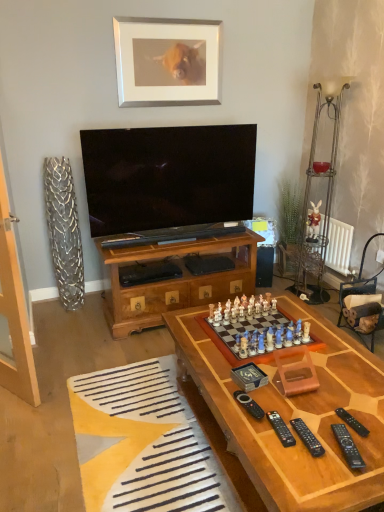
Question: Considering the relative sizes of black plastic remote at lower right, the third remote in the left-to-right sequence, and yellow fabric rug at lower left in the image provided, is black plastic remote at lower right, the third remote in the left-to-right sequence, bigger than yellow fabric rug at lower left?

Choices:
 (A) yes
 (B) no

Answer: (B)

Question: Can we say black plastic remote at lower right, which ranks as the 3th remote in right-to-left order, lies outside yellow fabric rug at lower left?

Choices:
 (A) yes
 (B) no

Answer: (A)

Question: Is black plastic remote at lower right, which ranks as the 3th remote in right-to-left order, oriented towards yellow fabric rug at lower left?

Choices:
 (A) yes
 (B) no

Answer: (B)

Question: Is black plastic remote at lower right, the third remote in the left-to-right sequence, closer to the viewer compared to yellow fabric rug at lower left?

Choices:
 (A) no
 (B) yes

Answer: (B)

Question: Is there a large distance between black plastic remote at lower right, the third remote in the left-to-right sequence, and yellow fabric rug at lower left?

Choices:
 (A) yes
 (B) no

Answer: (B)

Question: Do you think black plastic remote at lower right, the 4th remote in the right-to-left sequence, is within black plastic remote at center, which appears as the first remote when viewed from the left, or outside of it?

Choices:
 (A) inside
 (B) outside

Answer: (B)

Question: Is black plastic remote at lower right, the 4th remote in the right-to-left sequence, taller or shorter than black plastic remote at center, which ranks as the 5th remote in right-to-left order?

Choices:
 (A) short
 (B) tall

Answer: (A)

Question: Is black plastic remote at lower right, the 4th remote in the right-to-left sequence, wider or thinner than black plastic remote at center, which appears as the first remote when viewed from the left?

Choices:
 (A) thin
 (B) wide

Answer: (A)

Question: Considering the positions of point (281, 418) and point (253, 408), is point (281, 418) closer or farther from the camera than point (253, 408)?

Choices:
 (A) closer
 (B) farther

Answer: (A)

Question: Is black plastic remote at lower right, the first remote when ordered from right to left, wider or thinner than black plastic remote at lower right, which ranks as the 3th remote in right-to-left order?

Choices:
 (A) wide
 (B) thin

Answer: (B)

Question: Looking at the image, does black plastic remote at lower right, which appears as the 5th remote when viewed from the left, seem bigger or smaller compared to black plastic remote at lower right, which ranks as the 3th remote in right-to-left order?

Choices:
 (A) big
 (B) small

Answer: (B)

Question: In the image, is black plastic remote at lower right, the first remote when ordered from right to left, on the left side or the right side of black plastic remote at lower right, which ranks as the 3th remote in right-to-left order?

Choices:
 (A) left
 (B) right

Answer: (B)

Question: In terms of height, does black plastic remote at lower right, which appears as the 5th remote when viewed from the left, look taller or shorter compared to black plastic remote at lower right, the third remote in the left-to-right sequence?

Choices:
 (A) short
 (B) tall

Answer: (A)

Question: Looking at their shapes, would you say white radiator at right is wider or thinner than black plastic remote at lower right, the third remote in the left-to-right sequence?

Choices:
 (A) wide
 (B) thin

Answer: (B)

Question: From a real-world perspective, is white radiator at right physically located above or below black plastic remote at lower right, which ranks as the 3th remote in right-to-left order?

Choices:
 (A) below
 (B) above

Answer: (A)